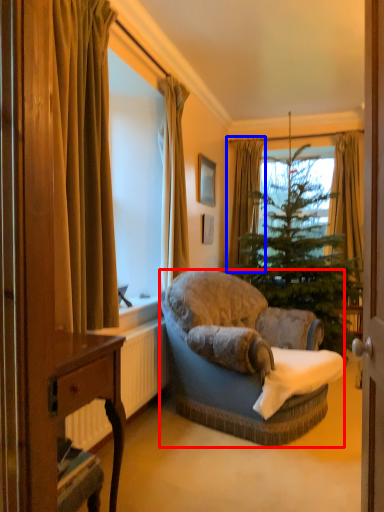
Question: Which object is further to the camera taking this photo, studio couch (highlighted by a red box) or curtain (highlighted by a blue box)?

Choices:
 (A) studio couch
 (B) curtain

Answer: (B)